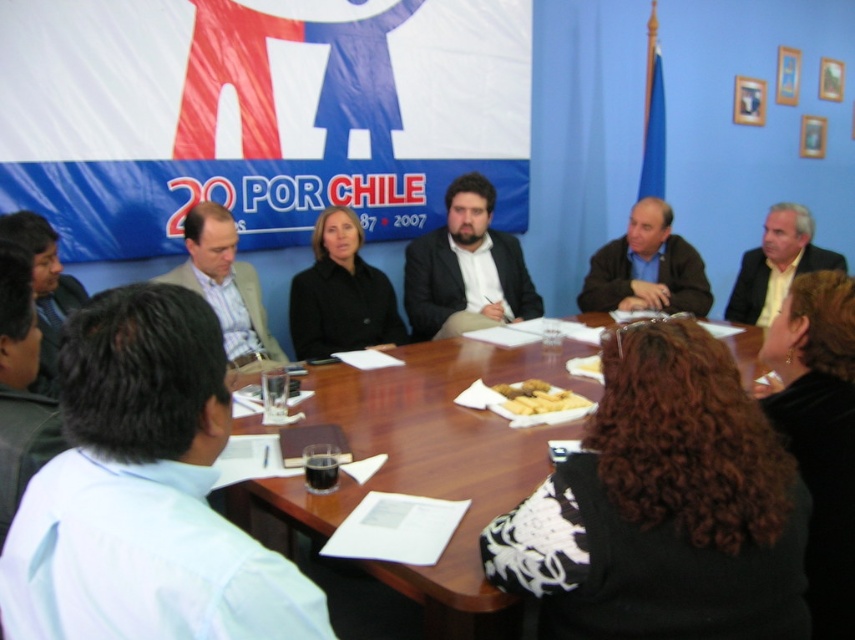
Can you confirm if dark brown leather jacket at right is positioned to the right of light brown suit at upper right?

No, dark brown leather jacket at right is not to the right of light brown suit at upper right.

Does dark brown leather jacket at right have a larger size compared to light brown suit at upper right?

Yes, dark brown leather jacket at right is bigger than light brown suit at upper right.

Between point (655, 212) and point (741, 264), which one is positioned behind?

The point (741, 264) is more distant.

Identify the location of dark brown leather jacket at right. The image size is (855, 640). (646, 268).

Measure the distance between point (x=514, y=269) and camera.

13.01 feet

Can you confirm if matte black suit at center is positioned above dark brown leather jacket at right?

No, matte black suit at center is not above dark brown leather jacket at right.

Between point (517, 275) and point (675, 280), which one is positioned behind?

Point (517, 275)

Identify the location of matte black suit at center. (466, 268).

Locate an element on the screen. wooden table at center is located at coordinates (431, 412).

Can you confirm if wooden table at center is thinner than light brown suit at upper right?

Incorrect, wooden table at center's width is not less than light brown suit at upper right's.

Is point (401, 454) positioned in front of point (752, 312)?

Yes, it is in front of point (752, 312).

You are a GUI agent. You are given a task and a screenshot of the screen. Output one action in this format:
    pyautogui.click(x=<x>, y=<y>)
    Task: Click on the wooden table at center
    The width and height of the screenshot is (855, 640).
    Given the screenshot: What is the action you would take?
    pyautogui.click(x=431, y=412)